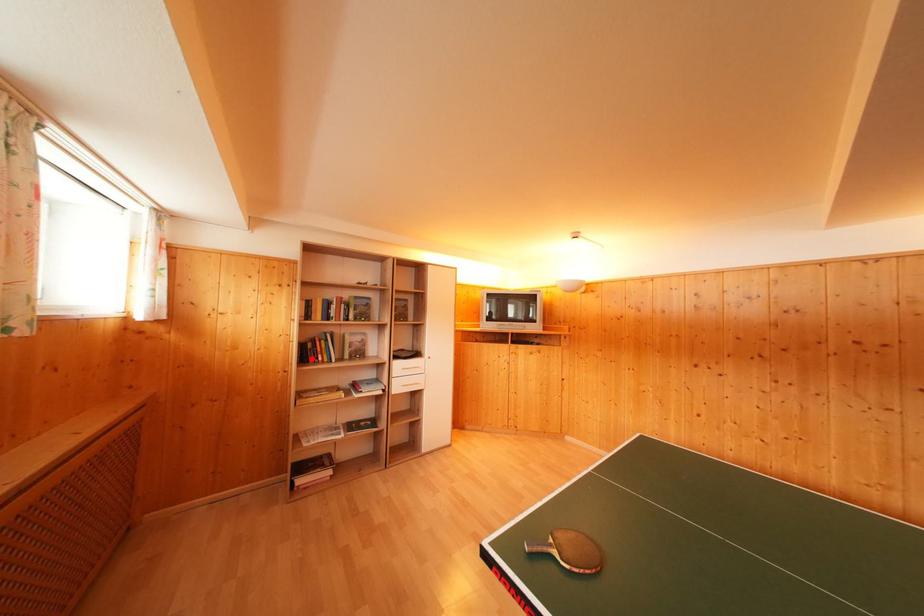
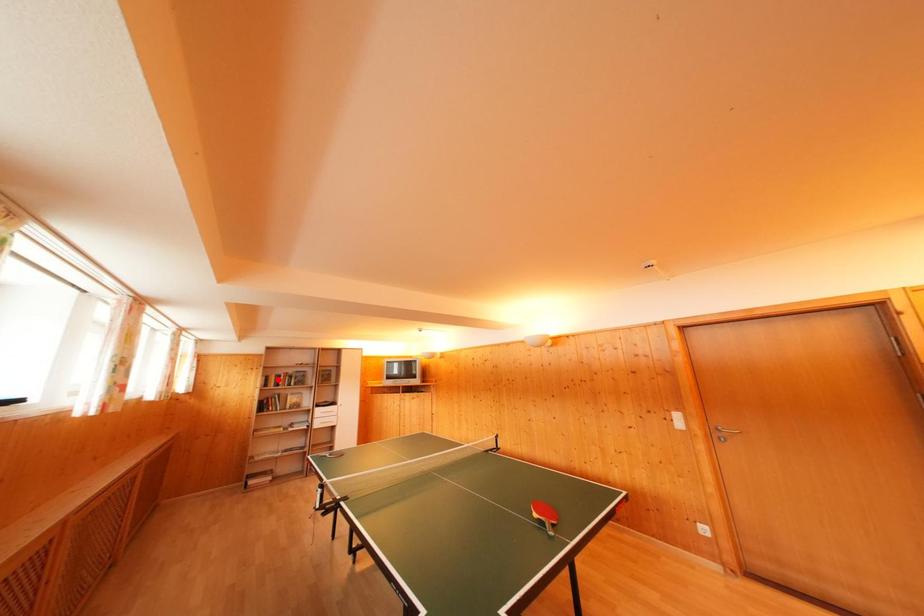
I am providing you with two images of the same scene from different viewpoints. A red point is marked on the first image and another point is marked on the second image. Does the point marked in image1 correspond to the same location as the one in image2?

No